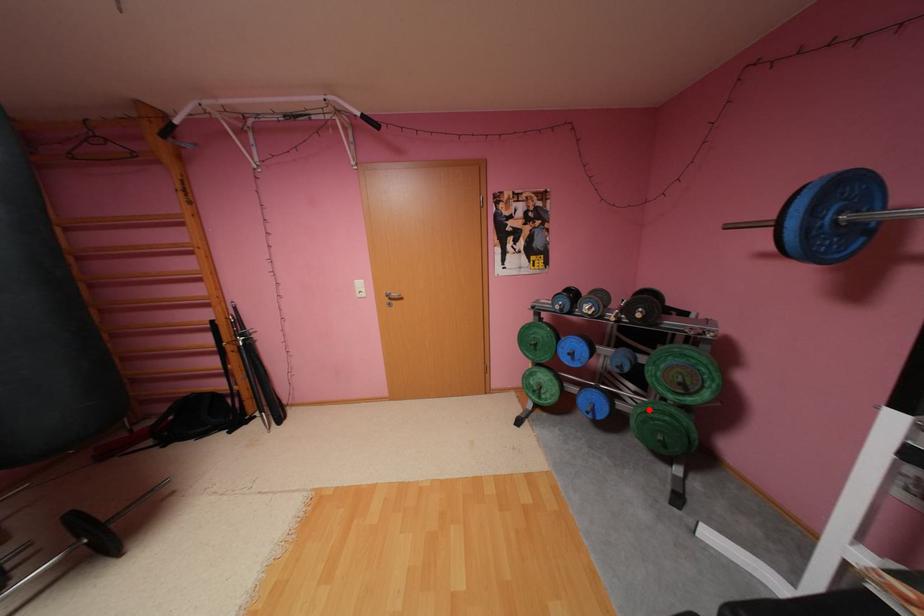
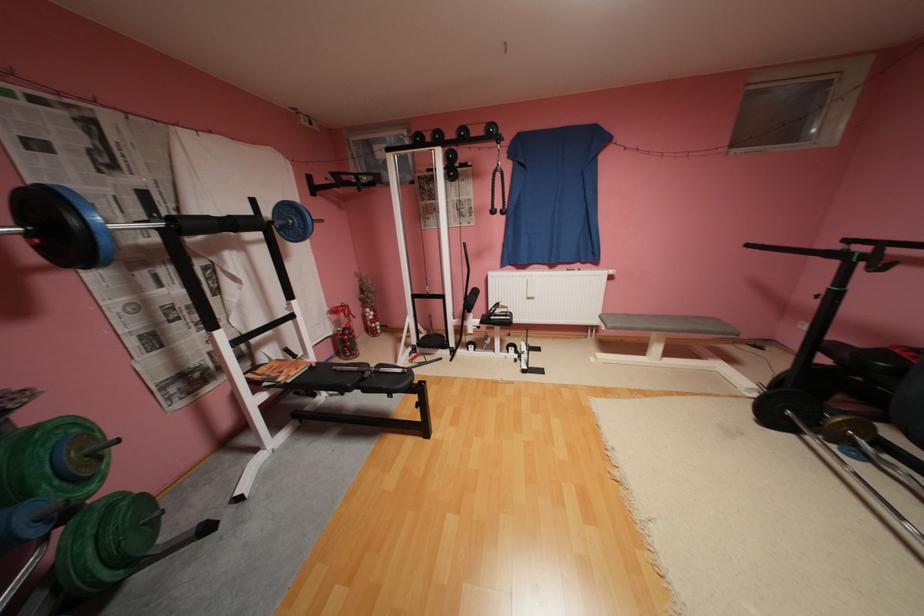
Question: I am providing you with two images of the same scene from different viewpoints. Image1 has a red point marked. In image2, the corresponding 3D location appears at what relative position? Reply with the corresponding letter.

Choices:
 (A) Closer
 (B) Farther

Answer: (B)